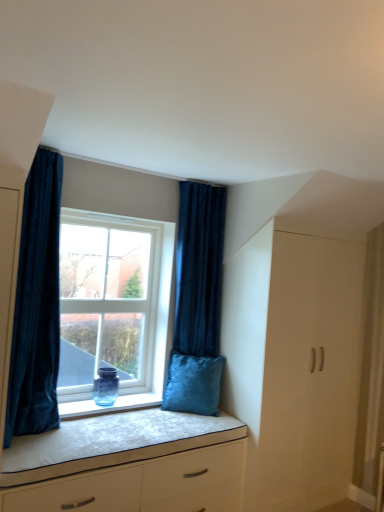
Identify the location of transparent glass window at center. (113, 301).

What do you see at coordinates (113, 301) in the screenshot?
I see `transparent glass window at center` at bounding box center [113, 301].

Image resolution: width=384 pixels, height=512 pixels. What do you see at coordinates (197, 302) in the screenshot? I see `velvet dark blue curtain at right, the 1th curtain viewed from the right` at bounding box center [197, 302].

This screenshot has width=384, height=512. What do you see at coordinates (294, 364) in the screenshot?
I see `white matte wardrobe at right` at bounding box center [294, 364].

What is the approximate height of white matte wardrobe at right?

The height of white matte wardrobe at right is 2.02 meters.

What do you see at coordinates (128, 465) in the screenshot? This screenshot has height=512, width=384. I see `white matte chest of drawers at lower center` at bounding box center [128, 465].

In order to face velvet blue pillow at window, should I rotate leftwards or rightwards?

Rotate right and turn 0.449 degrees.

Identify the location of transparent glass window at center. This screenshot has height=512, width=384. (113, 301).

Is white matte wardrobe at right taller or shorter than velvet dark blue curtain at left, which is the first curtain from left to right?

white matte wardrobe at right is taller than velvet dark blue curtain at left, which is the first curtain from left to right.

Is white matte wardrobe at right facing away from velvet dark blue curtain at left, which is the first curtain from left to right?

That's not correct — white matte wardrobe at right is not looking away from velvet dark blue curtain at left, which is the first curtain from left to right.

Considering their positions, is white matte wardrobe at right located in front of or behind velvet dark blue curtain at left, which is the first curtain from left to right?

Clearly, white matte wardrobe at right is behind velvet dark blue curtain at left, which is the first curtain from left to right.

Can you confirm if white matte wardrobe at right is wider than velvet dark blue curtain at left, which is the first curtain from left to right?

No.

From the image's perspective, is velvet dark blue curtain at left, which is the second curtain in back-to-front order, beneath transparent glass window at center?

No, from the image's perspective, velvet dark blue curtain at left, which is the second curtain in back-to-front order, is not beneath transparent glass window at center.

Which is closer, (x=25, y=312) or (x=78, y=219)?

Clearly, point (x=25, y=312) is closer to the camera than point (x=78, y=219).

Could you measure the distance between velvet dark blue curtain at left, which is the first curtain from left to right, and transparent glass window at center?

The distance of velvet dark blue curtain at left, which is the first curtain from left to right, from transparent glass window at center is 24.30 inches.

Based on the photo, can you tell me how much velvet dark blue curtain at left, which ranks as the 1th curtain in front-to-back order, and transparent glass window at center differ in facing direction?

0.000842 degrees separate the facing orientations of velvet dark blue curtain at left, which ranks as the 1th curtain in front-to-back order, and transparent glass window at center.

Is velvet blue pillow at window at the left side of white matte wardrobe at right?

Yes, velvet blue pillow at window is to the left of white matte wardrobe at right.

Would you say velvet blue pillow at window is inside or outside white matte wardrobe at right?

velvet blue pillow at window is not inside white matte wardrobe at right, it's outside.

Between velvet blue pillow at window and white matte wardrobe at right, which one has larger size?

white matte wardrobe at right is bigger.

Is point (170, 385) closer or farther from the camera than point (293, 502)?

Point (170, 385) is positioned farther from the camera compared to point (293, 502).

Image resolution: width=384 pixels, height=512 pixels. Find the location of `curtain below the velvet dark blue curtain at right, the first curtain in the back-to-front sequence (from a real-world perspective)`. curtain below the velvet dark blue curtain at right, the first curtain in the back-to-front sequence (from a real-world perspective) is located at coordinates (37, 305).

Is velvet dark blue curtain at right, which ranks as the 2th curtain in front-to-back order, to the left or to the right of velvet dark blue curtain at left, the 2th curtain viewed from the right, in the image?

In the image, velvet dark blue curtain at right, which ranks as the 2th curtain in front-to-back order, appears on the right side of velvet dark blue curtain at left, the 2th curtain viewed from the right.

Is velvet dark blue curtain at right, which ranks as the 2th curtain in front-to-back order, located outside velvet dark blue curtain at left, the 2th curtain viewed from the right?

Indeed, velvet dark blue curtain at right, which ranks as the 2th curtain in front-to-back order, is completely outside velvet dark blue curtain at left, the 2th curtain viewed from the right.

The height and width of the screenshot is (512, 384). Identify the location of file cabinet above the velvet blue pillow at window (from the image's perspective). (294, 364).

From the image's perspective, is white matte wardrobe at right under velvet blue pillow at window?

Incorrect, from the image's perspective, white matte wardrobe at right is higher than velvet blue pillow at window.

Is white matte wardrobe at right looking in the opposite direction of velvet blue pillow at window?

white matte wardrobe at right is not turned away from velvet blue pillow at window.

Is white matte wardrobe at right wider or thinner than velvet blue pillow at window?

In the image, white matte wardrobe at right appears to be more narrow than velvet blue pillow at window.

Can you confirm if white matte chest of drawers at lower center is bigger than velvet blue pillow at window?

Indeed, white matte chest of drawers at lower center has a larger size compared to velvet blue pillow at window.

At what (x,y) coordinates should I click in order to perform the action: click on the chest of drawers below the velvet blue pillow at window (from the image's perspective). Please return your answer as a coordinate pair (x, y). Looking at the image, I should click on (x=128, y=465).

Which point is more forward, (193, 429) or (164, 401)?

The point (193, 429) is closer to the camera.

From the image's perspective, which is below, white matte chest of drawers at lower center or velvet blue pillow at window?

white matte chest of drawers at lower center.

Consider the image. From a real-world perspective, which object stands above the other?

In real-world perspective, velvet dark blue curtain at right, which is the 2th curtain from left to right, is above.

Which is more to the left, white matte chest of drawers at lower center or velvet dark blue curtain at right, the 1th curtain viewed from the right?

Positioned to the left is white matte chest of drawers at lower center.

Considering the positions of objects white matte chest of drawers at lower center and velvet dark blue curtain at right, the 1th curtain viewed from the right, in the image provided, who is in front, white matte chest of drawers at lower center or velvet dark blue curtain at right, the 1th curtain viewed from the right,?

Positioned in front is white matte chest of drawers at lower center.

Does white matte chest of drawers at lower center have a lesser height compared to velvet dark blue curtain at right, which is the 2th curtain from left to right?

Indeed, white matte chest of drawers at lower center has a lesser height compared to velvet dark blue curtain at right, which is the 2th curtain from left to right.

The height and width of the screenshot is (512, 384). What are the coordinates of `file cabinet below the velvet dark blue curtain at left, which is the first curtain from left to right (from the image's perspective)` in the screenshot? It's located at (294, 364).

In order to click on curtain in front of the transparent glass window at center in this screenshot , I will do `click(37, 305)`.

Based on their spatial positions, is velvet dark blue curtain at left, which ranks as the 1th curtain in front-to-back order, or velvet dark blue curtain at right, which ranks as the 2th curtain in front-to-back order, further from velvet blue pillow at window?

velvet dark blue curtain at left, which ranks as the 1th curtain in front-to-back order, is positioned further to the anchor velvet blue pillow at window.

Looking at the image, which one is located closer to velvet blue pillow at window, transparent glass window at center or white matte wardrobe at right?

transparent glass window at center is positioned closer to the anchor velvet blue pillow at window.

Looking at the image, which one is located closer to velvet dark blue curtain at left, the 2th curtain viewed from the right, velvet dark blue curtain at right, which ranks as the 2th curtain in front-to-back order, or transparent glass window at center?

transparent glass window at center is positioned closer to the anchor velvet dark blue curtain at left, the 2th curtain viewed from the right.

Looking at this image, which object lies further to the anchor point white matte wardrobe at right, velvet blue pillow at window or transparent glass window at center?

The object further to white matte wardrobe at right is transparent glass window at center.

Which object lies further to the anchor point white matte chest of drawers at lower center, white matte wardrobe at right or velvet dark blue curtain at right, the 1th curtain viewed from the right?

Based on the image, white matte wardrobe at right appears to be further to white matte chest of drawers at lower center.

Looking at the image, which one is located further to white matte wardrobe at right, velvet dark blue curtain at left, the 2th curtain viewed from the right, or white matte chest of drawers at lower center?

Based on the image, velvet dark blue curtain at left, the 2th curtain viewed from the right, appears to be further to white matte wardrobe at right.

Consider the image. Considering their positions, is velvet dark blue curtain at right, which is the 2th curtain from left to right, positioned closer to velvet blue pillow at window than white matte wardrobe at right?

The object closer to velvet blue pillow at window is velvet dark blue curtain at right, which is the 2th curtain from left to right.

When comparing their distances from white matte chest of drawers at lower center, does white matte wardrobe at right or transparent glass window at center seem closer?

white matte wardrobe at right is closer to white matte chest of drawers at lower center.

Locate an element on the screen. This screenshot has width=384, height=512. curtain between transparent glass window at center and white matte wardrobe at right in the horizontal direction is located at coordinates (197, 302).

You are a GUI agent. You are given a task and a screenshot of the screen. Output one action in this format:
    pyautogui.click(x=<x>, y=<y>)
    Task: Click on the chest of drawers between velvet dark blue curtain at left, which is the first curtain from left to right, and white matte wardrobe at right from left to right
    This screenshot has width=384, height=512.
    Given the screenshot: What is the action you would take?
    pyautogui.click(x=128, y=465)

Locate an element on the screen. The height and width of the screenshot is (512, 384). pillow between transparent glass window at center and velvet dark blue curtain at right, the 1th curtain viewed from the right, in the horizontal direction is located at coordinates (193, 384).

Find the location of `pillow between velvet dark blue curtain at left, which is the first curtain from left to right, and white matte wardrobe at right, in the horizontal direction`. pillow between velvet dark blue curtain at left, which is the first curtain from left to right, and white matte wardrobe at right, in the horizontal direction is located at coordinates (193, 384).